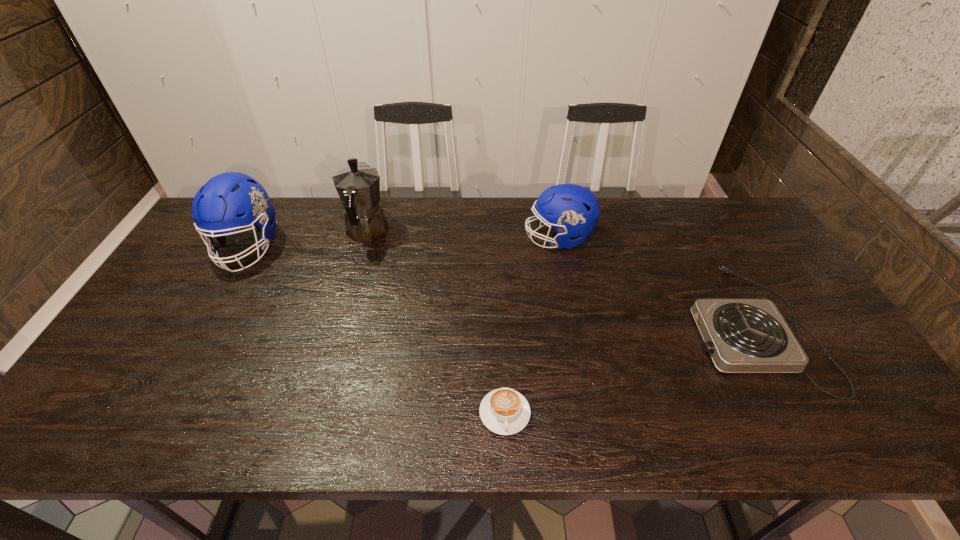
The image size is (960, 540). Identify the location of vacant space located 0.340m on the front-facing side of the second object from right to left. (420, 238).

Locate an element on the screen. Image resolution: width=960 pixels, height=540 pixels. vacant area situated 0.350m with a retractable cable on the side of the hotplate is located at coordinates pyautogui.click(x=557, y=327).

The width and height of the screenshot is (960, 540). What are the coordinates of `vacant space positioned with a retractable cable on the side of the hotplate` in the screenshot? It's located at (625, 327).

I want to click on free space located 0.150m with a retractable cable on the side of the hotplate, so click(632, 327).

Where is `coffeepot positioned at the far edge`? The image size is (960, 540). coffeepot positioned at the far edge is located at coordinates (358, 186).

Where is `object that is at the near edge`? object that is at the near edge is located at coordinates (504, 411).

The width and height of the screenshot is (960, 540). Find the location of `object located in the left edge section of the desktop`. object located in the left edge section of the desktop is located at coordinates (229, 201).

Where is `object that is at the right edge`? object that is at the right edge is located at coordinates (741, 335).

Locate an element on the screen. object that is at the far left corner is located at coordinates (229, 201).

At what (x,y) coordinates should I click in order to perform the action: click on vacant space at the far edge of the desktop. Please return your answer as a coordinate pair (x, y). The width and height of the screenshot is (960, 540). Looking at the image, I should click on (280, 205).